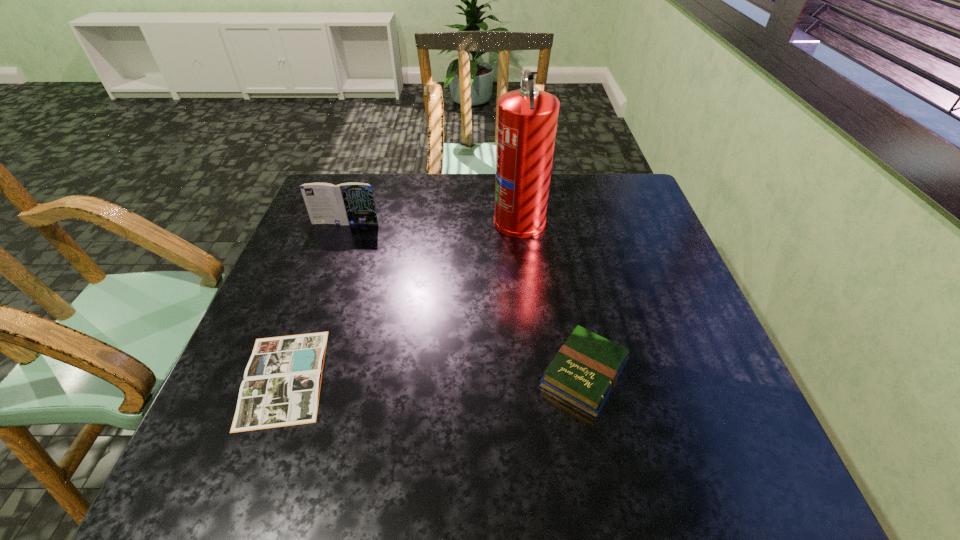
I want to click on vacant space in between the farthest book and the fire extinguisher, so click(432, 221).

Image resolution: width=960 pixels, height=540 pixels. In order to click on vacant area that lies between the third tallest object and the tallest book in this screenshot , I will do `click(465, 299)`.

Identify the location of vacant area between the shortest object and the tallest book. (315, 300).

The height and width of the screenshot is (540, 960). What are the coordinates of `free space that is in between the shortest book and the fire extinguisher` in the screenshot? It's located at (401, 299).

Identify the location of free point between the shortest object and the third shortest object. (315, 300).

Find the location of a particular element. free space between the farthest book and the shortest book is located at coordinates (315, 300).

The height and width of the screenshot is (540, 960). I want to click on vacant point located between the fire extinguisher and the second tallest book, so click(x=552, y=297).

In order to click on vacant region between the third shortest object and the second tallest book in this screenshot , I will do `click(465, 299)`.

Where is `vacant space that is in between the tallest object and the rightmost book`? vacant space that is in between the tallest object and the rightmost book is located at coordinates pyautogui.click(x=552, y=297).

In order to click on object that is the second closest one to the farthest book in this screenshot , I will do `click(281, 387)`.